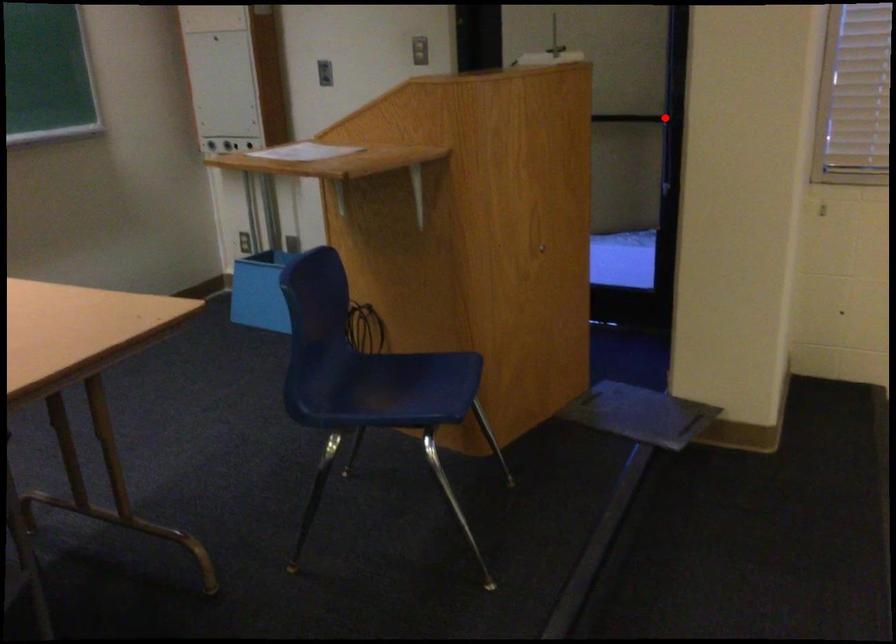
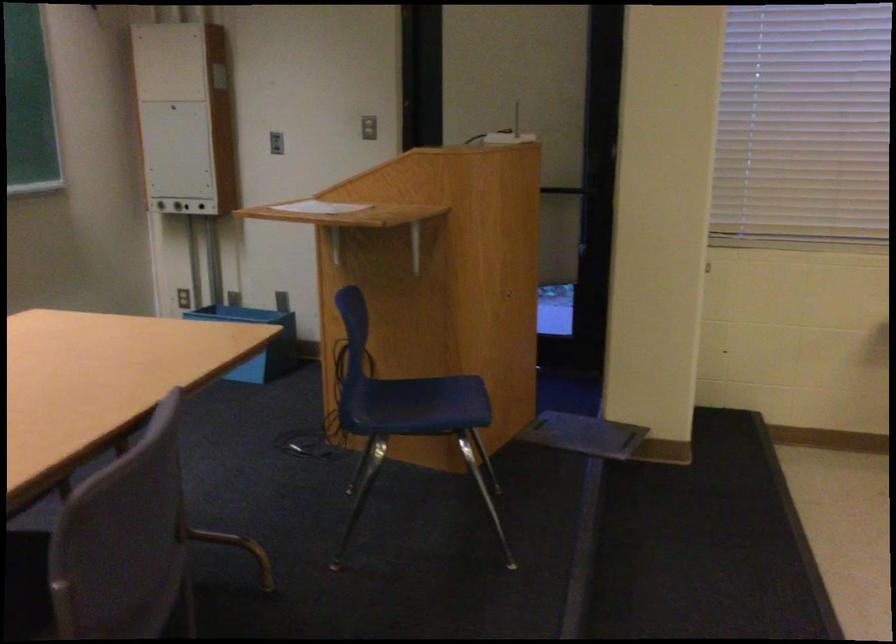
Question: A red point is marked in image1. In image2, is the corresponding 3D point closer to the camera or farther? Reply with the corresponding letter.

Choices:
 (A) The corresponding 3D point is closer.
 (B) The corresponding 3D point is farther.

Answer: (B)